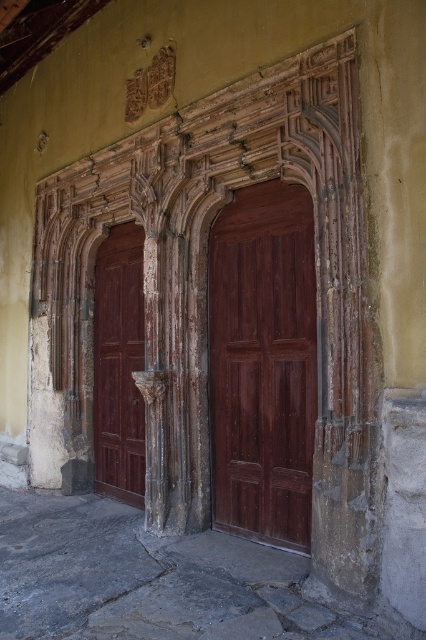
Question: Is wooden carved archway at center wider than matte wood door at center?

Choices:
 (A) no
 (B) yes

Answer: (A)

Question: Among these points, which one is farthest from the camera?

Choices:
 (A) (132, 241)
 (B) (176, 268)
 (C) (216, 237)

Answer: (A)

Question: Among these objects, which one is farthest from the camera?

Choices:
 (A) matte wood door at center
 (B) wooden carved archway at center

Answer: (B)

Question: Does wooden carved archway at center lie in front of matte wood door at center?

Choices:
 (A) yes
 (B) no

Answer: (B)

Question: Which object is farther from the camera taking this photo?

Choices:
 (A) wooden carved archway at center
 (B) matte wood door at center

Answer: (A)

Question: Considering the relative positions of matte wood door at center and matte wood door at left in the image provided, where is matte wood door at center located with respect to matte wood door at left?

Choices:
 (A) above
 (B) below

Answer: (A)